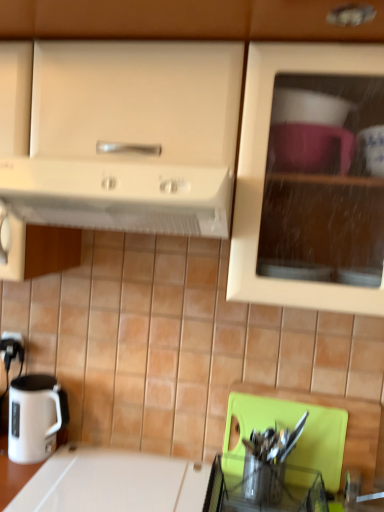
Where is `blank space situated above white glossy countertop at lower left (from a real-world perspective)`? blank space situated above white glossy countertop at lower left (from a real-world perspective) is located at coordinates (125, 477).